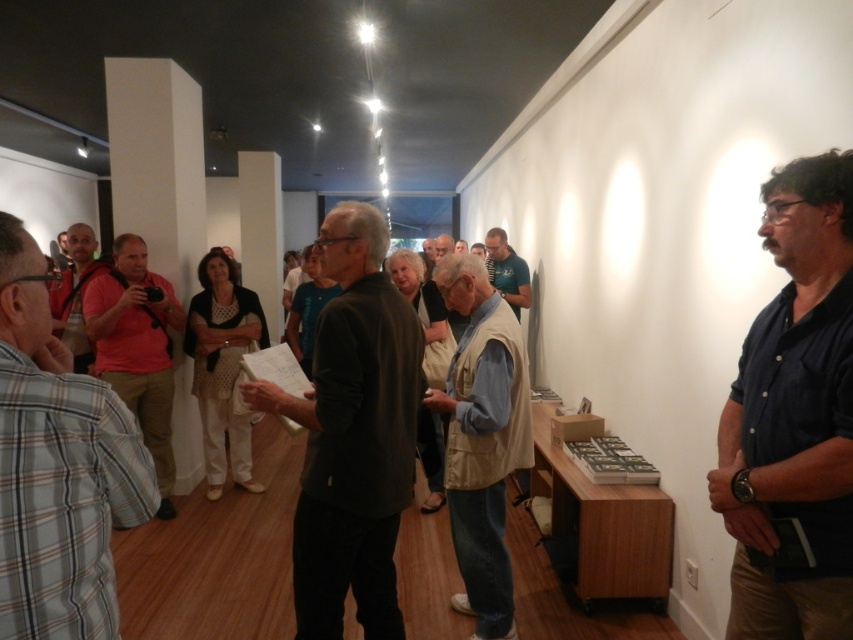
Is dark blue shirt at right wider than matte black backpack at left?

No, dark blue shirt at right is not wider than matte black backpack at left.

This screenshot has height=640, width=853. In order to click on dark blue shirt at right in this screenshot , I will do `click(793, 417)`.

Does dark blue shirt at right have a lesser width compared to matte red shirt at left?

Correct, dark blue shirt at right's width is less than matte red shirt at left's.

Which is more to the left, dark blue shirt at right or matte red shirt at left?

matte red shirt at left

Consider the image. Who is more distant from viewer, (849, 216) or (132, 330)?

Point (132, 330)

You are a GUI agent. You are given a task and a screenshot of the screen. Output one action in this format:
    pyautogui.click(x=<x>, y=<y>)
    Task: Click on the dark blue shirt at right
    
    Given the screenshot: What is the action you would take?
    pyautogui.click(x=793, y=417)

Who is shorter, plaid shirt at left or matte red shirt at left?

With less height is plaid shirt at left.

Can you confirm if plaid shirt at left is positioned above matte red shirt at left?

Yes.

At what (x,y) coordinates should I click in order to perform the action: click on plaid shirt at left. Please return your answer as a coordinate pair (x, y). Looking at the image, I should click on (57, 467).

Identify the location of plaid shirt at left. This screenshot has height=640, width=853. (57, 467).